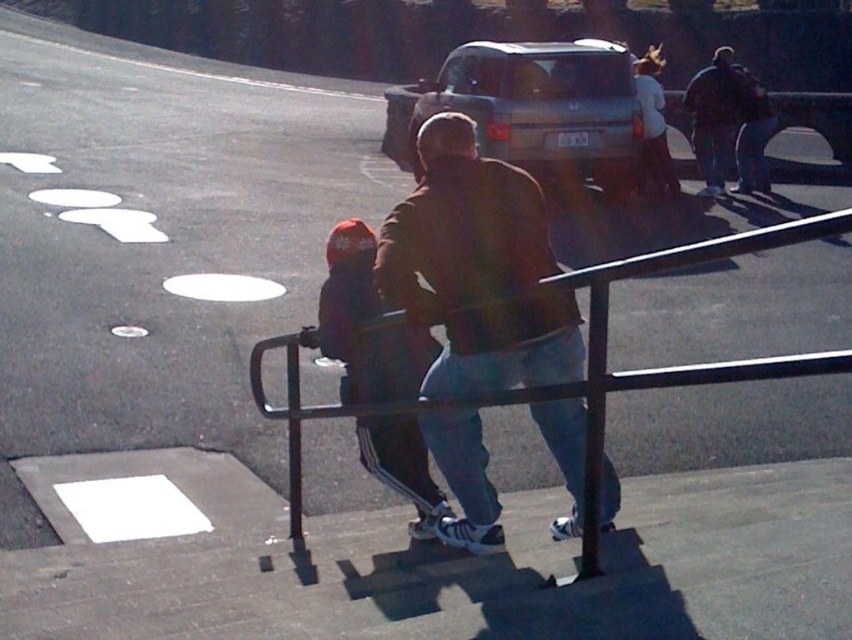
Question: Is brown leather jacket at center bigger than silver metallic suv at center?

Choices:
 (A) yes
 (B) no

Answer: (A)

Question: Can you confirm if black metal railing at center is positioned to the left of dark blue fabric jacket at center?

Choices:
 (A) yes
 (B) no

Answer: (A)

Question: Does brown leather jacket at center have a lesser width compared to black metal railing at center?

Choices:
 (A) no
 (B) yes

Answer: (A)

Question: Estimate the real-world distances between objects in this image. Which object is closer to the black metal railing at center?

Choices:
 (A) dark blue fabric jacket at center
 (B) brown leather jacket at center
 (C) dark brown jacket at upper right

Answer: (A)

Question: Which object is closer to the camera taking this photo?

Choices:
 (A) dark brown jacket at upper right
 (B) silver metallic suv at center
 (C) dark blue fabric jacket at center
 (D) black metal railing at center

Answer: (C)

Question: Which object is farther from the camera taking this photo?

Choices:
 (A) silver metallic suv at center
 (B) black metal railing at center
 (C) brown leather jacket at center

Answer: (A)